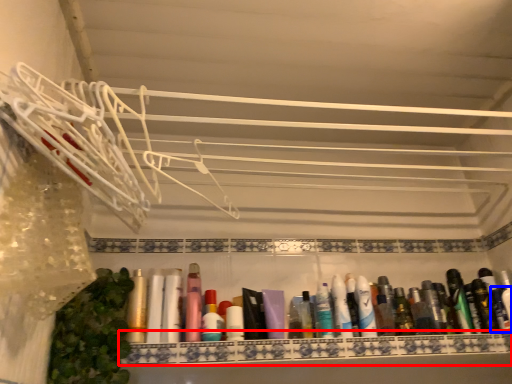
Question: Which of the following is the closest to the observer, cabinet (highlighted by a red box) or toiletry (highlighted by a blue box)?

Choices:
 (A) cabinet
 (B) toiletry

Answer: (A)